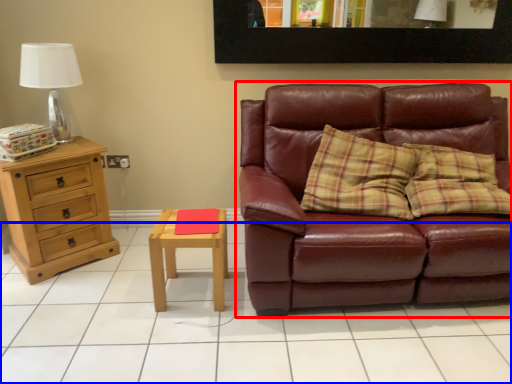
Question: Which object is further to the camera taking this photo, studio couch (highlighted by a red box) or tile (highlighted by a blue box)?

Choices:
 (A) studio couch
 (B) tile

Answer: (A)